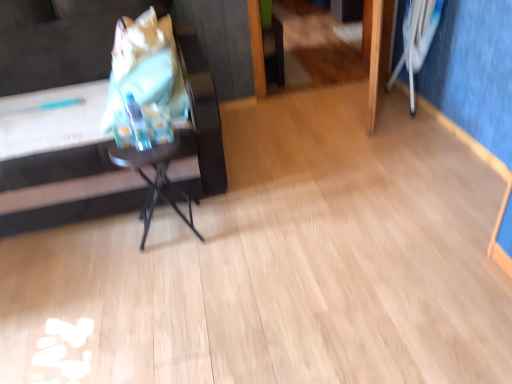
Locate an element on the screen. This screenshot has height=384, width=512. free space on the front side of metallic black table at center is located at coordinates (168, 274).